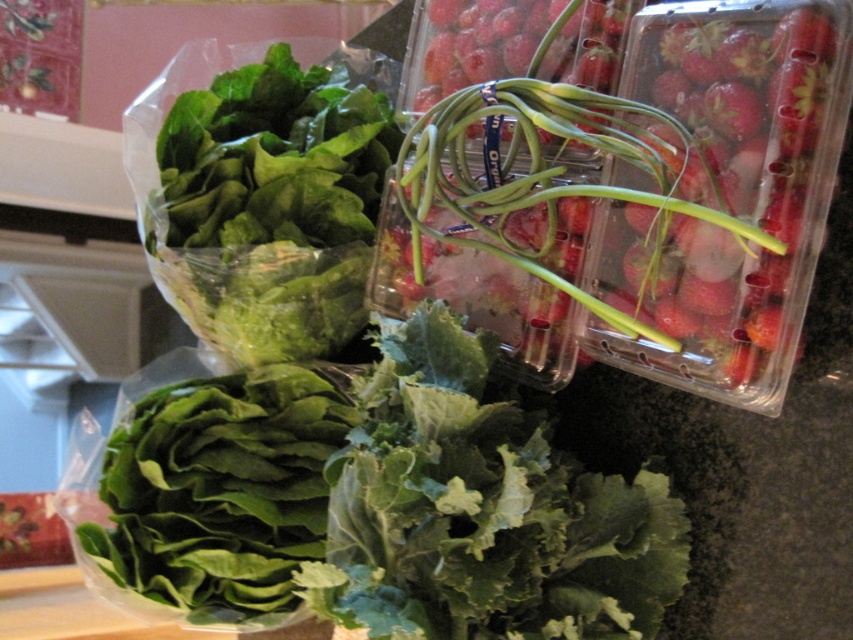
Question: Which object is positioned farthest from the green leafy lettuce at upper left?

Choices:
 (A) green leafy at center
 (B) green leafy lettuce at lower left
 (C) shiny red strawberries at upper right

Answer: (A)

Question: Does shiny red strawberries at upper right appear over green leafy lettuce at upper left?

Choices:
 (A) yes
 (B) no

Answer: (B)

Question: Estimate the real-world distances between objects in this image. Which object is farther from the green leafy at center?

Choices:
 (A) shiny red strawberries at upper right
 (B) green leafy lettuce at lower left

Answer: (A)

Question: In this image, where is green leafy lettuce at upper left located relative to green leafy lettuce at lower left?

Choices:
 (A) right
 (B) left

Answer: (A)

Question: Which of the following is the closest to the observer?

Choices:
 (A) shiny red strawberries at upper right
 (B) green leafy at center
 (C) green leafy lettuce at upper left
 (D) green leafy lettuce at lower left

Answer: (A)

Question: Is green leafy at center thinner than green leafy lettuce at upper left?

Choices:
 (A) no
 (B) yes

Answer: (A)